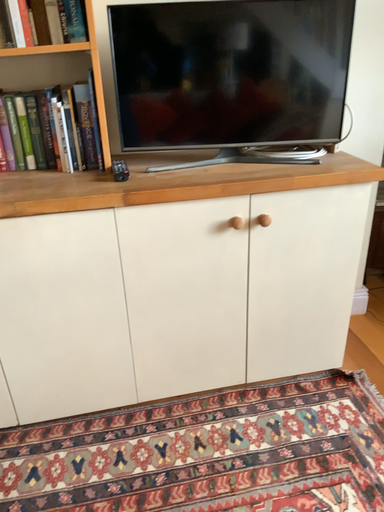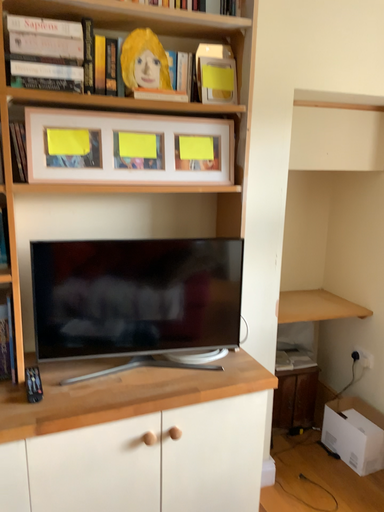
Question: How did the camera likely rotate when shooting the video?

Choices:
 (A) rotated right
 (B) rotated left

Answer: (A)